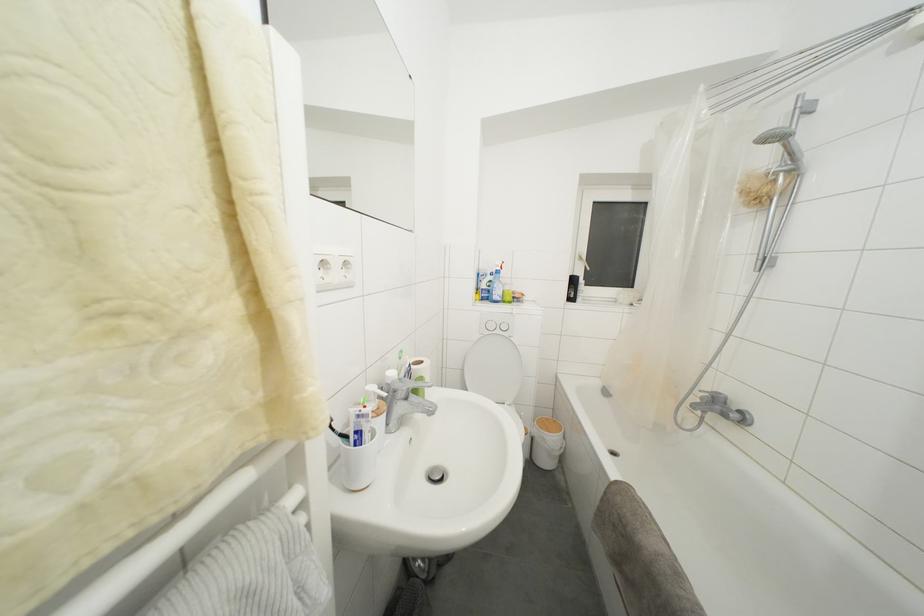
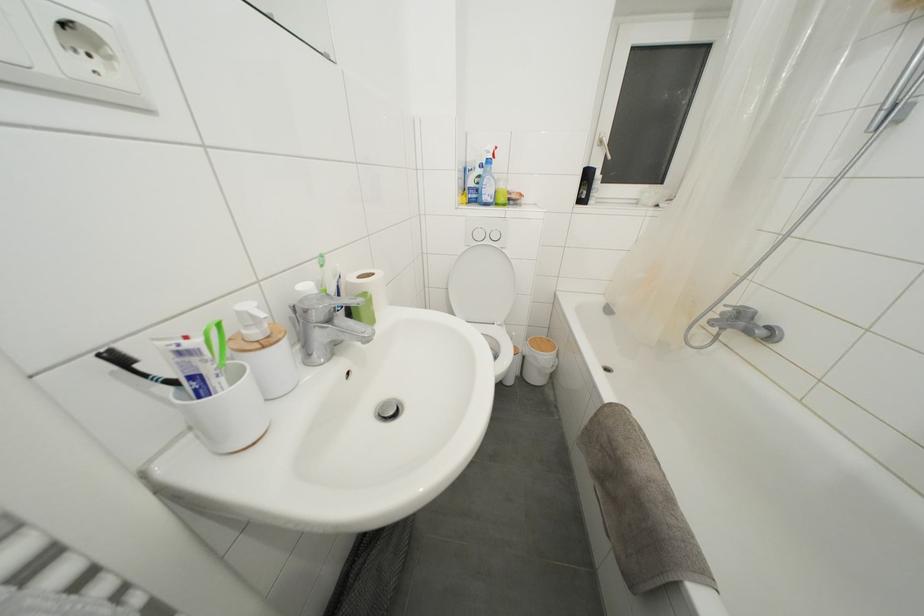
Where in the second image is the point corresponding to the point at 500,302 from the first image?

(490, 203)